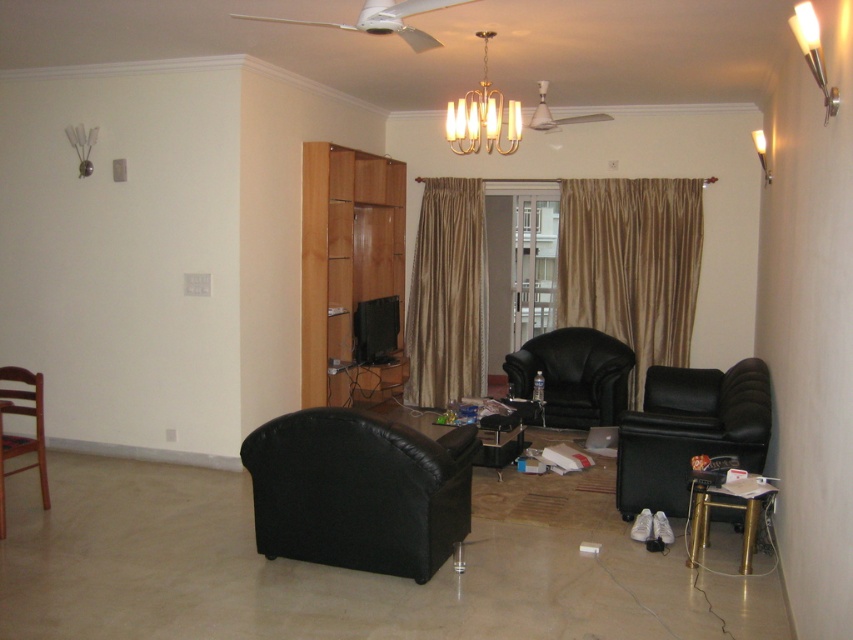
Question: Is brown textured curtain at right positioned in front of black leather armchair at center?

Choices:
 (A) no
 (B) yes

Answer: (A)

Question: Which point is closer to the camera?

Choices:
 (A) brown wooden chair at left
 (B) gold silk curtain at center

Answer: (A)

Question: Which of the following is the closest to the observer?

Choices:
 (A) (643, 397)
 (B) (672, 209)
 (C) (595, 413)

Answer: (A)

Question: Is black leather armchair at right in front of brown wooden chair at left?

Choices:
 (A) yes
 (B) no

Answer: (B)

Question: Which object is farther from the camera taking this photo?

Choices:
 (A) black leather couch at center
 (B) gold metallic chandelier at upper center
 (C) gold silk curtain at center

Answer: (C)

Question: Is black leather couch at center to the right of black leather armchair at center from the viewer's perspective?

Choices:
 (A) yes
 (B) no

Answer: (B)